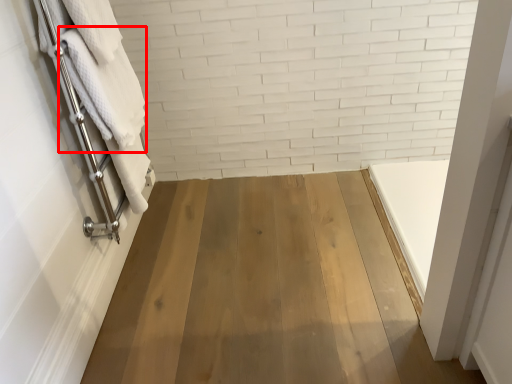
Question: From the image's perspective, what is the correct spatial positioning of bath towel (annotated by the red box) in reference to bath towel?

Choices:
 (A) below
 (B) above

Answer: (B)